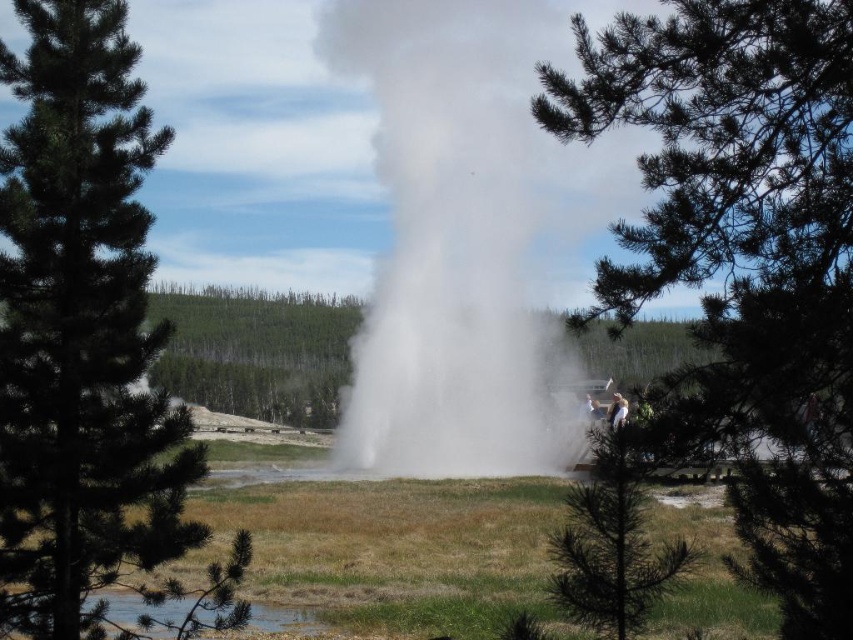
Can you confirm if clear water at lower left is taller than white cotton shirt at center?

Correct, clear water at lower left is much taller as white cotton shirt at center.

Is clear water at lower left wider than white cotton shirt at center?

Incorrect, clear water at lower left's width does not surpass white cotton shirt at center's.

Does point (120, 625) come closer to viewer compared to point (625, 408)?

Yes, it is.

Where is `clear water at lower left`? The height and width of the screenshot is (640, 853). clear water at lower left is located at coordinates (138, 608).

The height and width of the screenshot is (640, 853). What do you see at coordinates (743, 259) in the screenshot?
I see `green leafy tree at center` at bounding box center [743, 259].

Is point (773, 499) closer to camera compared to point (494, 92)?

Yes, point (773, 499) is closer to viewer.

Who is more distant from viewer, (695, 35) or (421, 216)?

The point (421, 216) is more distant.

Image resolution: width=853 pixels, height=640 pixels. I want to click on green leafy tree at center, so click(743, 259).

Describe the element at coordinates (743, 259) in the screenshot. The height and width of the screenshot is (640, 853). I see `green leafy tree at center` at that location.

How distant is green leafy tree at center from white cotton shirt at center?

green leafy tree at center is 30.64 meters from white cotton shirt at center.

Is point (788, 460) positioned before point (614, 404)?

Yes, it is in front of point (614, 404).

Locate an element on the screen. This screenshot has height=640, width=853. green leafy tree at center is located at coordinates (743, 259).